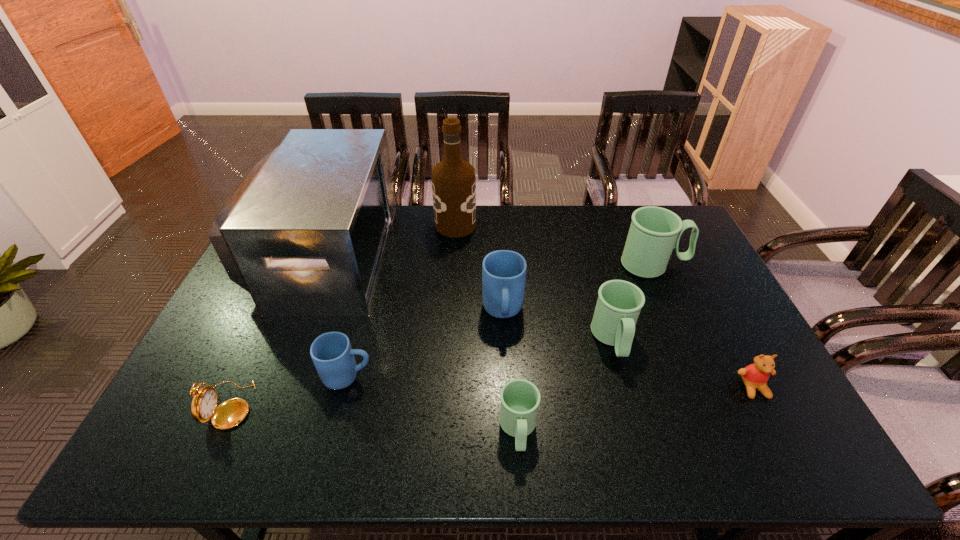
Locate an element on the screen. This screenshot has width=960, height=540. green mug identified as the second closest to the smallest green mug is located at coordinates (654, 232).

At what (x,y) coordinates should I click in order to perform the action: click on free point that satisfies the following two spatial constraints: 1. on the side of the rightmost green mug with the handle; 2. on the side of the smallest green mug with the handle. Please return your answer as a coordinate pair (x, y). The image size is (960, 540). Looking at the image, I should click on (725, 430).

I want to click on vacant space that satisfies the following two spatial constraints: 1. on the side of the second smallest green mug with the handle; 2. on the side of the smaller blue mug with the handle, so click(x=624, y=376).

You are a GUI agent. You are given a task and a screenshot of the screen. Output one action in this format:
    pyautogui.click(x=<x>, y=<y>)
    Task: Click on the free spot that satisfies the following two spatial constraints: 1. on the side of the second smallest green mug with the handle; 2. on the face of the pocket watch
    The image size is (960, 540).
    Given the screenshot: What is the action you would take?
    pyautogui.click(x=632, y=405)